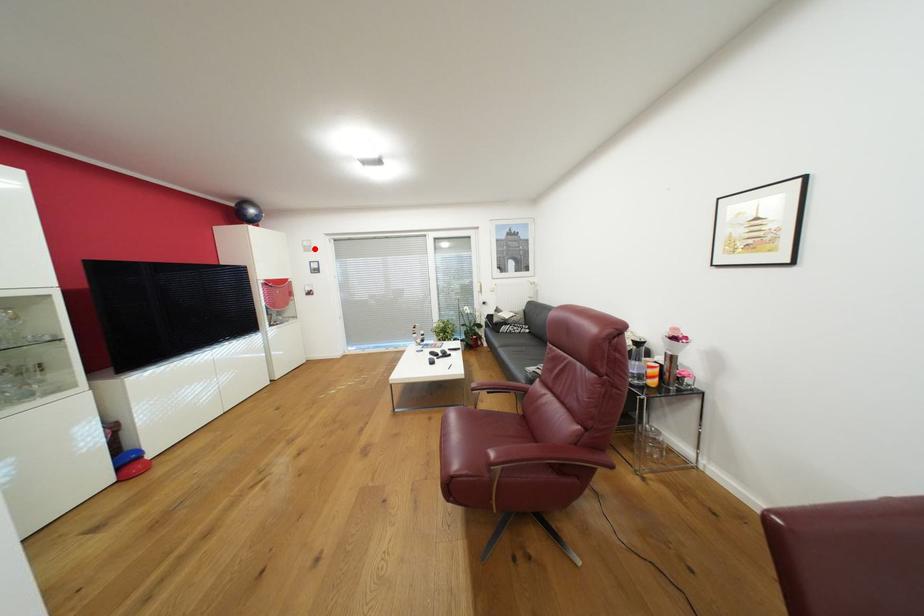
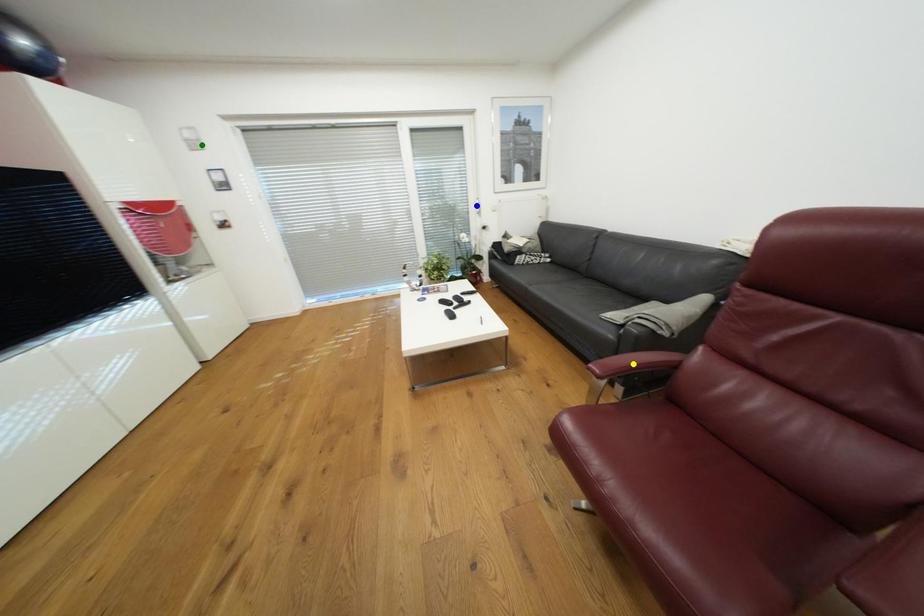
Question: I am providing you with two images of the same scene from different viewpoints. A red point is marked on the first image. You are given multiple points on the second image. Which point in image 2 is actually the same real-world point as the red point in image 1?

Choices:
 (A) yellow point
 (B) blue point
 (C) green point

Answer: (C)